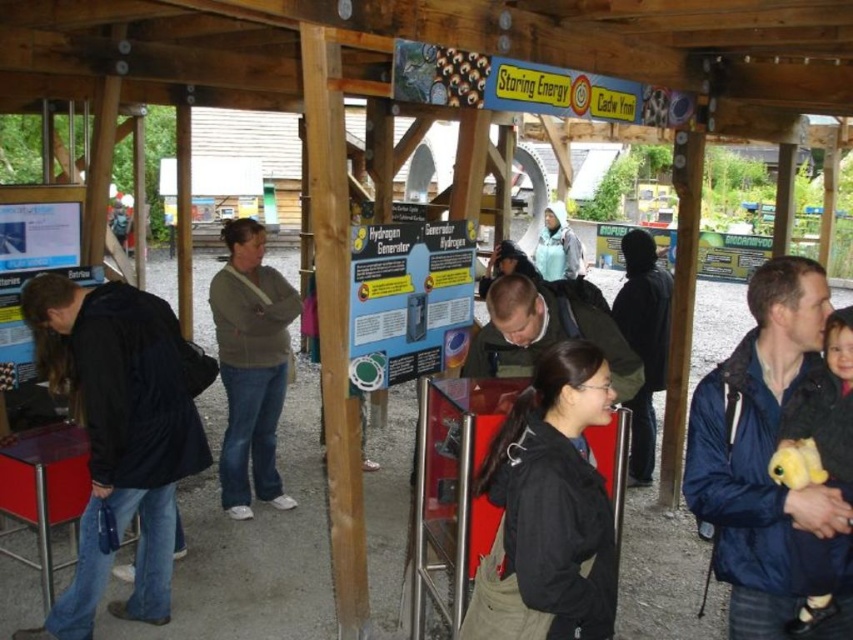
The width and height of the screenshot is (853, 640). In order to click on blue fabric jacket at center in this screenshot , I will do `click(766, 461)`.

Which is below, blue fabric jacket at center or light blue fabric at center?

blue fabric jacket at center is lower down.

Does point (846, 532) come closer to viewer compared to point (550, 250)?

Yes.

At what (x,y) coordinates should I click in order to perform the action: click on blue fabric jacket at center. Please return your answer as a coordinate pair (x, y). This screenshot has height=640, width=853. Looking at the image, I should click on (766, 461).

Which is below, black matte jacket at center or matte green jacket at center?

black matte jacket at center is below.

Is black matte jacket at center shorter than matte green jacket at center?

Yes, black matte jacket at center is shorter than matte green jacket at center.

Locate an element on the screen. The width and height of the screenshot is (853, 640). black matte jacket at center is located at coordinates (548, 509).

Image resolution: width=853 pixels, height=640 pixels. In order to click on black matte jacket at center in this screenshot , I will do `click(548, 509)`.

Based on the photo, is dark blue jacket at left above blue fabric jacket at center?

Actually, dark blue jacket at left is below blue fabric jacket at center.

Does dark blue jacket at left lie in front of blue fabric jacket at center?

No, dark blue jacket at left is behind blue fabric jacket at center.

The image size is (853, 640). What do you see at coordinates (120, 435) in the screenshot? I see `dark blue jacket at left` at bounding box center [120, 435].

Find the location of a particular element. Image resolution: width=853 pixels, height=640 pixels. dark blue jacket at left is located at coordinates (120, 435).